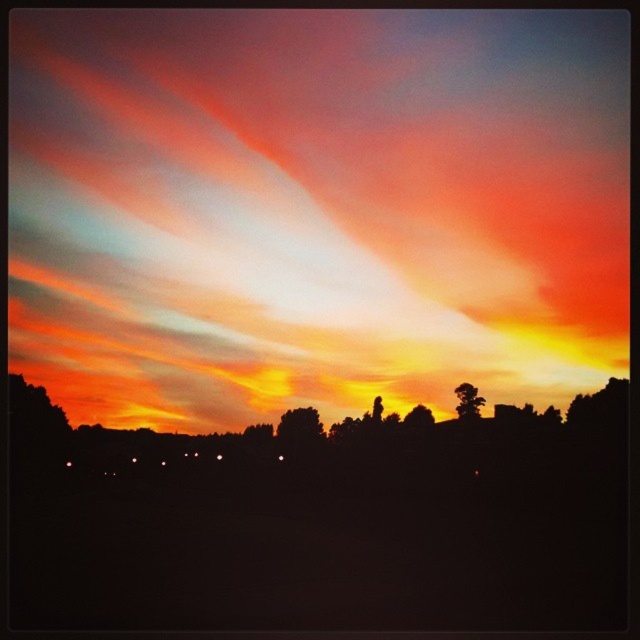
How much distance is there between translucent orange cloud at upper center and brown textured tree at upper right?

They are 6.20 feet apart.

Does translucent orange cloud at upper center have a greater height compared to brown textured tree at upper right?

→ Yes, translucent orange cloud at upper center is taller than brown textured tree at upper right.

You are a GUI agent. You are given a task and a screenshot of the screen. Output one action in this format:
    pyautogui.click(x=<x>, y=<y>)
    Task: Click on the translucent orange cloud at upper center
    This screenshot has height=640, width=640.
    Given the screenshot: What is the action you would take?
    pyautogui.click(x=314, y=209)

This screenshot has height=640, width=640. Find the location of `translucent orange cloud at upper center`. translucent orange cloud at upper center is located at coordinates click(x=314, y=209).

Does green leafy tree at center appear on the right side of silky brown tree at center?

In fact, green leafy tree at center is to the left of silky brown tree at center.

Can you confirm if green leafy tree at center is smaller than silky brown tree at center?

Actually, green leafy tree at center might be larger than silky brown tree at center.

Does point (320, 426) lie in front of point (422, 404)?

Yes, point (320, 426) is in front of point (422, 404).

Where is `green leafy tree at center`? The image size is (640, 640). green leafy tree at center is located at coordinates (x=300, y=428).

The image size is (640, 640). What do you see at coordinates (300, 428) in the screenshot?
I see `green leafy tree at center` at bounding box center [300, 428].

Between point (285, 417) and point (467, 385), which one is positioned in front?

Point (285, 417)

Which is behind, point (280, 438) or point (476, 390)?

The point (476, 390) is more distant.

You are a GUI agent. You are given a task and a screenshot of the screen. Output one action in this format:
    pyautogui.click(x=<x>, y=<y>)
    Task: Click on the green leafy tree at center
    This screenshot has width=640, height=640.
    Given the screenshot: What is the action you would take?
    pyautogui.click(x=300, y=428)